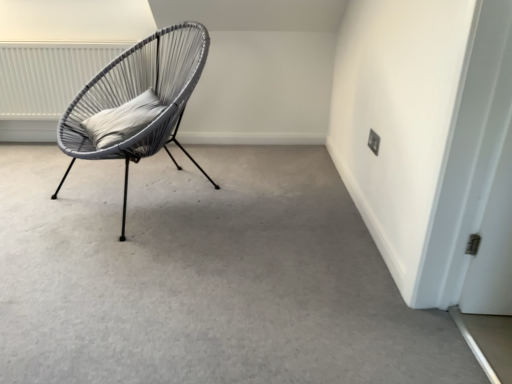
You are a GUI agent. You are given a task and a screenshot of the screen. Output one action in this format:
    pyautogui.click(x=<x>, y=<y>)
    Task: Click on the free spot in front of matte grey wicker chair at left
    
    Given the screenshot: What is the action you would take?
    pyautogui.click(x=128, y=263)